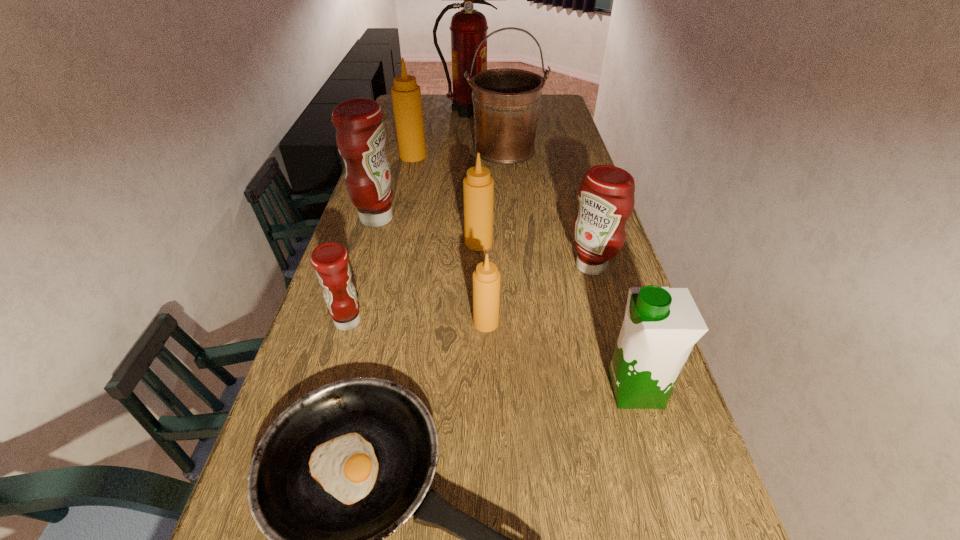
Locate an element on the screen. The height and width of the screenshot is (540, 960). vacant area between the farthest tan condiment and the fire extinguisher is located at coordinates (441, 133).

Where is `free space between the second farthest red condiment and the nearest red condiment`? free space between the second farthest red condiment and the nearest red condiment is located at coordinates (469, 294).

You are a GUI agent. You are given a task and a screenshot of the screen. Output one action in this format:
    pyautogui.click(x=<x>, y=<y>)
    Task: Click on the empty location between the farthest object and the green soya milk
    The width and height of the screenshot is (960, 540).
    Given the screenshot: What is the action you would take?
    pyautogui.click(x=552, y=250)

Identify the location of unoccupied area between the smallest tan condiment and the green soya milk. (561, 356).

Where is `free space that is in between the bucket and the green soya milk`? Image resolution: width=960 pixels, height=540 pixels. free space that is in between the bucket and the green soya milk is located at coordinates (570, 269).

Where is `empty space that is in between the nearest tan condiment and the smallest red condiment`? Image resolution: width=960 pixels, height=540 pixels. empty space that is in between the nearest tan condiment and the smallest red condiment is located at coordinates (417, 322).

Identify the location of free space between the second smallest tan condiment and the green soya milk. (558, 316).

Where is `object that ranks as the second closest to the smallest tan condiment`? This screenshot has width=960, height=540. object that ranks as the second closest to the smallest tan condiment is located at coordinates (606, 198).

Find the location of a particular element. Image resolution: width=960 pixels, height=540 pixels. object identified as the eighth closest to the nearest tan condiment is located at coordinates (406, 95).

Locate which condiment is the fifth closest to the second farthest tan condiment. Please provide its 2D coordinates. Your answer should be formatted as a tuple, i.e. [(x, y)], where the tuple contains the x and y coordinates of a point satisfying the conditions above.

[(406, 95)]